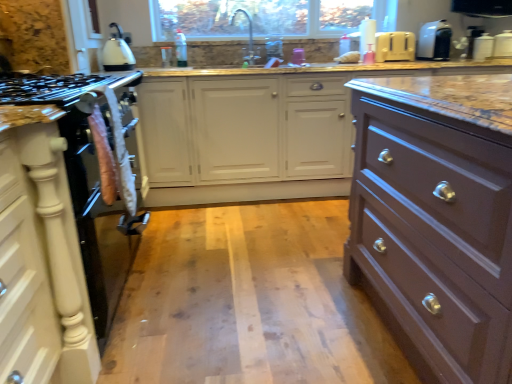
This screenshot has width=512, height=384. I want to click on white matte cabinet at left, so click(41, 256).

What do you see at coordinates (434, 41) in the screenshot?
I see `white plastic toaster at upper right, the second appliance viewed from the left` at bounding box center [434, 41].

The height and width of the screenshot is (384, 512). Describe the element at coordinates (249, 39) in the screenshot. I see `satin nickel faucet at upper center` at that location.

Find the location of `satin nickel faucet at upper center`. satin nickel faucet at upper center is located at coordinates (249, 39).

The image size is (512, 384). What do you see at coordinates (437, 216) in the screenshot?
I see `satin brown drawer at right` at bounding box center [437, 216].

At what (x,y) coordinates should I click in order to perform the action: click on white glossy toaster at upper right, which is counted as the second appliance, starting from the right. Please return your answer as a coordinate pair (x, y). Looking at the image, I should click on (483, 47).

The image size is (512, 384). Find the location of `white matte cabinet at left`. white matte cabinet at left is located at coordinates (41, 256).

Is satin brown drawer at right aimed at white plastic toaster at upper right, which is counted as the first appliance, starting from the left?

No, satin brown drawer at right is not turned towards white plastic toaster at upper right, which is counted as the first appliance, starting from the left.

You are a GUI agent. You are given a task and a screenshot of the screen. Output one action in this format:
    pyautogui.click(x=<x>, y=<y>)
    Task: Click on the 1st appliance to the right when counting from the satin brown drawer at right
    The image size is (512, 384).
    Given the screenshot: What is the action you would take?
    pyautogui.click(x=395, y=46)

Looking at this image, who is more distant, satin brown drawer at right or white plastic toaster at upper right, the 4th appliance positioned from the right?

Positioned behind is white plastic toaster at upper right, the 4th appliance positioned from the right.

Considering the positions of objects satin brown drawer at right and white plastic toaster at upper right, which is counted as the first appliance, starting from the left, in the image provided, who is more to the left, satin brown drawer at right or white plastic toaster at upper right, which is counted as the first appliance, starting from the left,?

satin brown drawer at right is more to the left.

From the image's perspective, which object appears higher, satin brown drawer at right or satin nickel faucet at upper center?

From the image's view, satin nickel faucet at upper center is above.

Which point is more forward, (429, 337) or (234, 13)?

The point (429, 337) is closer.

Is satin brown drawer at right inside the boundaries of satin nickel faucet at upper center, or outside?

satin brown drawer at right cannot be found inside satin nickel faucet at upper center.

In the scene shown: Does satin brown drawer at right have a smaller size compared to white plastic toaster at upper right, the third appliance viewed from the right?

No, satin brown drawer at right is not smaller than white plastic toaster at upper right, the third appliance viewed from the right.

Is satin brown drawer at right facing towards white plastic toaster at upper right, the third appliance viewed from the right?

No, satin brown drawer at right is not facing towards white plastic toaster at upper right, the third appliance viewed from the right.

Which object is positioned more to the left, satin brown drawer at right or white plastic toaster at upper right, the second appliance viewed from the left?

satin brown drawer at right.

At what (x,y) coordinates should I click in order to perform the action: click on the chest of drawers that is under the white plastic toaster at upper right, the second appliance viewed from the left (from a real-world perspective). Please return your answer as a coordinate pair (x, y). Looking at the image, I should click on (437, 216).

Is white plastic container at upper right, the first appliance viewed from the right, in front of marble countertop at center?

No.

From a real-world perspective, between white plastic container at upper right, the first appliance viewed from the right, and marble countertop at center, who is vertically higher?

In real-world perspective, white plastic container at upper right, the first appliance viewed from the right, is above.

Does white plastic container at upper right, acting as the 4th appliance starting from the left, have a greater height compared to marble countertop at center?

No.

Does satin nickel faucet at upper center appear on the right side of white glossy toaster at upper right, which is counted as the second appliance, starting from the right?

No.

Identify the location of faucet on the left of white glossy toaster at upper right, the third appliance in the left-to-right sequence. The image size is (512, 384). (249, 39).

Is satin nickel faucet at upper center bigger than white glossy toaster at upper right, which is counted as the second appliance, starting from the right?

Yes, satin nickel faucet at upper center is bigger than white glossy toaster at upper right, which is counted as the second appliance, starting from the right.

Is satin nickel faucet at upper center aimed at white glossy toaster at upper right, the third appliance in the left-to-right sequence?

No, satin nickel faucet at upper center is not oriented towards white glossy toaster at upper right, the third appliance in the left-to-right sequence.

Can you confirm if white plastic container at upper right, acting as the 4th appliance starting from the left, is positioned to the right of white matte cabinet at left?

Correct, you'll find white plastic container at upper right, acting as the 4th appliance starting from the left, to the right of white matte cabinet at left.

Which object is further away from the camera taking this photo, white plastic container at upper right, the first appliance viewed from the right, or white matte cabinet at left?

white plastic container at upper right, the first appliance viewed from the right, is more distant.

Locate an element on the screen. Image resolution: width=512 pixels, height=384 pixels. cabinetry on the left side of white plastic container at upper right, the first appliance viewed from the right is located at coordinates (41, 256).

Who is shorter, white plastic container at upper right, acting as the 4th appliance starting from the left, or white matte cabinet at left?

white plastic container at upper right, acting as the 4th appliance starting from the left, is shorter.

Which appliance is the 1st one when counting from the right side of the white glossy kettle at upper left? Please provide its 2D coordinates.

[(395, 46)]

Is white glossy kettle at upper left next to white plastic toaster at upper right, which is counted as the first appliance, starting from the left, and touching it?

There is a gap between white glossy kettle at upper left and white plastic toaster at upper right, which is counted as the first appliance, starting from the left.

Which is correct: white glossy kettle at upper left is inside white plastic toaster at upper right, which is counted as the first appliance, starting from the left, or outside of it?

white glossy kettle at upper left is not inside white plastic toaster at upper right, which is counted as the first appliance, starting from the left, it's outside.

Identify the location of the chest of drawers in front of the white plastic toaster at upper right, which is counted as the first appliance, starting from the left. Image resolution: width=512 pixels, height=384 pixels. (437, 216).

Locate an element on the screen. Image resolution: width=512 pixels, height=384 pixels. faucet that is on the left side of satin brown drawer at right is located at coordinates (249, 39).

Estimate the real-world distances between objects in this image. Which object is closer to satin brown drawer at right, marble countertop at center or white glossy kettle at upper left?

marble countertop at center lies closer to satin brown drawer at right than the other object.

When comparing their distances from white plastic toaster at upper right, which is counted as the first appliance, starting from the left, does satin nickel faucet at upper center or white glossy kettle at upper left seem further?

white glossy kettle at upper left is positioned further to the anchor white plastic toaster at upper right, which is counted as the first appliance, starting from the left.

Estimate the real-world distances between objects in this image. Which object is closer to white plastic container at upper right, the first appliance viewed from the right, white plastic toaster at upper right, the third appliance viewed from the right, or marble countertop at center?

Based on the image, white plastic toaster at upper right, the third appliance viewed from the right, appears to be nearer to white plastic container at upper right, the first appliance viewed from the right.

From the image, which object appears to be farther from satin brown drawer at right, white plastic toaster at upper right, the 4th appliance positioned from the right, or white glossy kettle at upper left?

white glossy kettle at upper left is further to satin brown drawer at right.

From the picture: Considering their positions, is marble countertop at center positioned further to white plastic toaster at upper right, the second appliance viewed from the left, than satin brown drawer at right?

satin brown drawer at right lies further to white plastic toaster at upper right, the second appliance viewed from the left, than the other object.

Looking at the image, which one is located closer to white plastic toaster at upper right, the third appliance viewed from the right, white glossy kettle at upper left or white plastic container at upper right, acting as the 4th appliance starting from the left?

white plastic container at upper right, acting as the 4th appliance starting from the left, is positioned closer to the anchor white plastic toaster at upper right, the third appliance viewed from the right.

Which object lies further to the anchor point white glossy kettle at upper left, satin brown drawer at right or white plastic toaster at upper right, the 4th appliance positioned from the right?

Based on the image, satin brown drawer at right appears to be further to white glossy kettle at upper left.

Considering their positions, is white matte cabinet at left positioned closer to white plastic toaster at upper right, the second appliance viewed from the left, than satin nickel faucet at upper center?

satin nickel faucet at upper center is positioned closer to the anchor white plastic toaster at upper right, the second appliance viewed from the left.

Where is `counter between white matte cabinet at left and white plastic toaster at upper right, which is counted as the first appliance, starting from the left, in the front-back direction`? counter between white matte cabinet at left and white plastic toaster at upper right, which is counted as the first appliance, starting from the left, in the front-back direction is located at coordinates (256, 131).

Identify the location of counter between white glossy kettle at upper left and white plastic toaster at upper right, the 4th appliance positioned from the right, in the horizontal direction. Image resolution: width=512 pixels, height=384 pixels. (256, 131).

Locate an element on the screen. Image resolution: width=512 pixels, height=384 pixels. kitchen appliance between white matte cabinet at left and white plastic toaster at upper right, the second appliance viewed from the left, from front to back is located at coordinates (117, 52).

You are a GUI agent. You are given a task and a screenshot of the screen. Output one action in this format:
    pyautogui.click(x=<x>, y=<y>)
    Task: Click on the counter positioned between white matte cabinet at left and white plastic toaster at upper right, the third appliance viewed from the right, from near to far
    
    Given the screenshot: What is the action you would take?
    pyautogui.click(x=256, y=131)